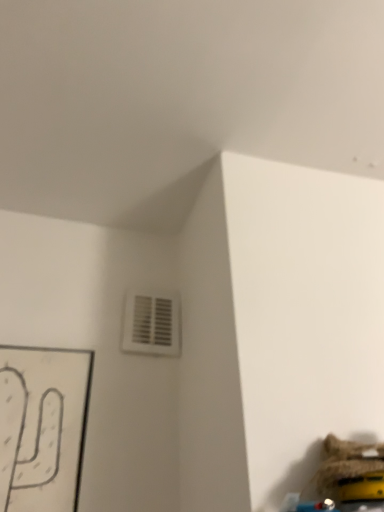
Question: From a real-world perspective, is white plastic vent at upper center above or below fuzzy fabric toy at lower right?

Choices:
 (A) above
 (B) below

Answer: (A)

Question: Does point (135, 343) appear closer or farther from the camera than point (370, 482)?

Choices:
 (A) farther
 (B) closer

Answer: (A)

Question: Which is correct: white plastic vent at upper center is inside fuzzy fabric toy at lower right, or outside of it?

Choices:
 (A) inside
 (B) outside

Answer: (B)

Question: Looking at the image, does fuzzy fabric toy at lower right seem bigger or smaller compared to white plastic vent at upper center?

Choices:
 (A) big
 (B) small

Answer: (A)

Question: Is fuzzy fabric toy at lower right taller or shorter than white plastic vent at upper center?

Choices:
 (A) tall
 (B) short

Answer: (B)

Question: Based on their positions, is fuzzy fabric toy at lower right located to the left or right of white plastic vent at upper center?

Choices:
 (A) right
 (B) left

Answer: (A)

Question: Is fuzzy fabric toy at lower right inside the boundaries of white plastic vent at upper center, or outside?

Choices:
 (A) outside
 (B) inside

Answer: (A)